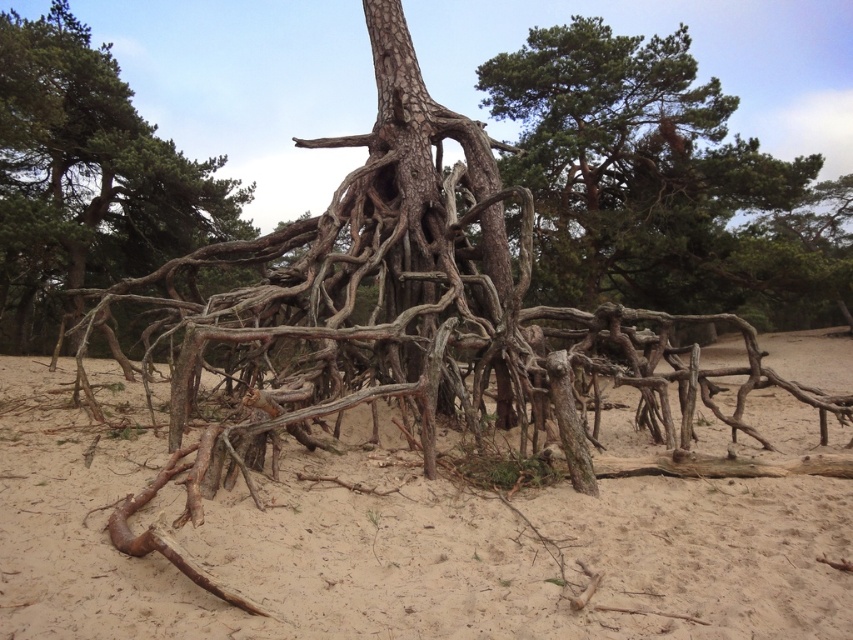
You are a geologist studying the root system of the tree in the image. You need to determine the exact location of the brown wood roots at center. What are their coordinates?

The brown wood roots at center are located at coordinates point (404, 547).

You are standing in front of the tree and want to touch both the brown wood roots at center and the green textured pine tree at upper center. Which one can you reach first without moving your position?

The brown wood roots at center can be reached first because it is closer to the viewer than the green textured pine tree at upper center.